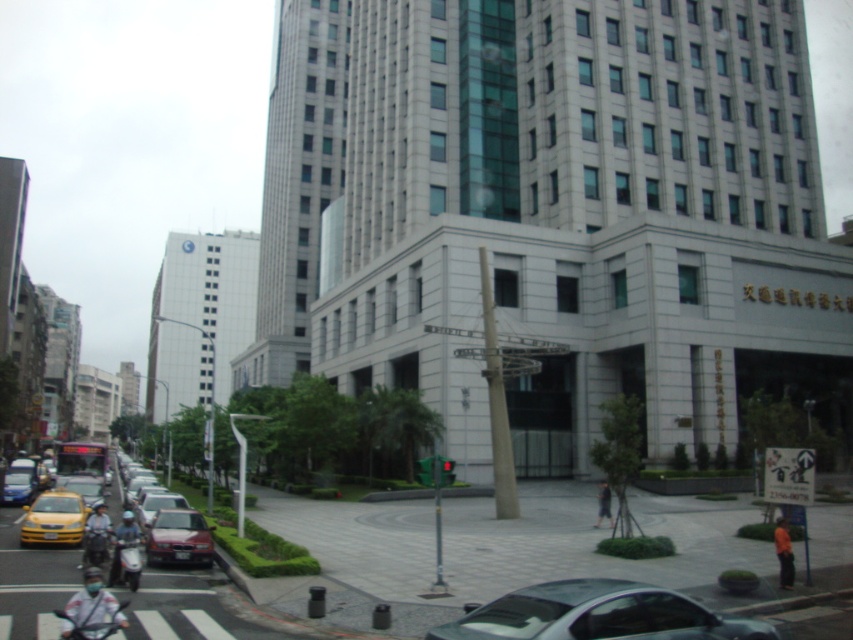
Question: Is metallic gray car at lower center smaller than matte blue sedan at lower left?

Choices:
 (A) no
 (B) yes

Answer: (A)

Question: Can you confirm if shiny red car at center is positioned to the left of yellow matte taxi at lower left?

Choices:
 (A) yes
 (B) no

Answer: (B)

Question: Which object is positioned farthest from the metallic gray car at lower center?

Choices:
 (A) matte blue sedan at lower left
 (B) shiny red car at center

Answer: (A)

Question: Among these points, which one is farthest from the camera?

Choices:
 (A) (531, 630)
 (B) (28, 483)
 (C) (183, 531)
 (D) (22, 529)

Answer: (B)

Question: Which object appears farthest from the camera in this image?

Choices:
 (A) yellow matte taxi at lower left
 (B) metallic gray car at lower center
 (C) shiny red car at center
 (D) matte blue sedan at lower left

Answer: (D)

Question: Observing the image, what is the correct spatial positioning of yellow matte taxi at lower left in reference to matte blue sedan at lower left?

Choices:
 (A) above
 (B) below

Answer: (A)